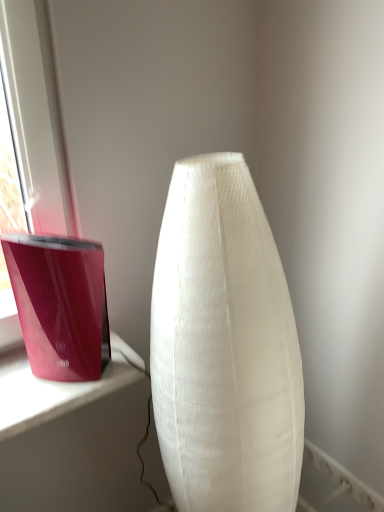
Question: Does glossy plastic candle holder at left have a greater width compared to white fabric lamp at center?

Choices:
 (A) yes
 (B) no

Answer: (B)

Question: Is glossy plastic candle holder at left in contact with white fabric lamp at center?

Choices:
 (A) no
 (B) yes

Answer: (A)

Question: Is glossy plastic candle holder at left turned away from white fabric lamp at center?

Choices:
 (A) yes
 (B) no

Answer: (B)

Question: Is glossy plastic candle holder at left far away from white fabric lamp at center?

Choices:
 (A) no
 (B) yes

Answer: (A)

Question: From a real-world perspective, is glossy plastic candle holder at left under white fabric lamp at center?

Choices:
 (A) yes
 (B) no

Answer: (B)

Question: Is glossy plastic candle holder at left at the right side of white fabric lamp at center?

Choices:
 (A) no
 (B) yes

Answer: (A)

Question: Is white fabric lamp at center bigger than glossy plastic candle holder at left?

Choices:
 (A) yes
 (B) no

Answer: (A)

Question: Is white fabric lamp at center oriented towards glossy plastic candle holder at left?

Choices:
 (A) no
 (B) yes

Answer: (A)

Question: Does white fabric lamp at center come in front of glossy plastic candle holder at left?

Choices:
 (A) yes
 (B) no

Answer: (A)

Question: Is white fabric lamp at center to the left of glossy plastic candle holder at left from the viewer's perspective?

Choices:
 (A) no
 (B) yes

Answer: (A)

Question: Is white fabric lamp at center oriented away from glossy plastic candle holder at left?

Choices:
 (A) yes
 (B) no

Answer: (B)

Question: Is white fabric lamp at center next to glossy plastic candle holder at left?

Choices:
 (A) no
 (B) yes

Answer: (A)

Question: From a real-world perspective, is white fabric lamp at center above or below glossy plastic candle holder at left?

Choices:
 (A) below
 (B) above

Answer: (A)